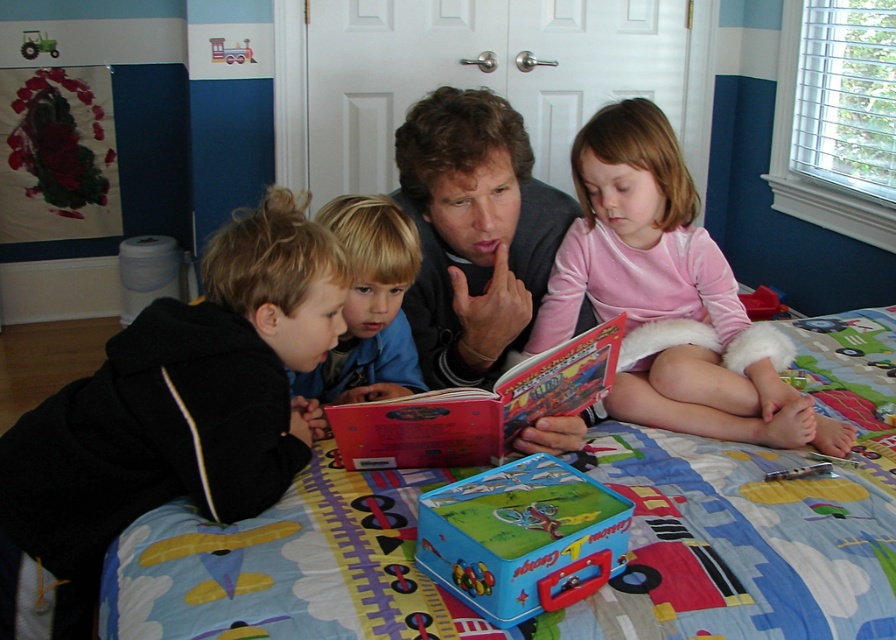
Question: Which of the following is the farthest from the observer?

Choices:
 (A) (799, 420)
 (B) (246, 497)

Answer: (A)

Question: Can you confirm if printed fabric quilt at center is positioned below black fleece hoodie at lower left?

Choices:
 (A) yes
 (B) no

Answer: (A)

Question: Does pink fleece skirt at center have a larger size compared to matte black sweater at center?

Choices:
 (A) no
 (B) yes

Answer: (B)

Question: Which point is farther from the camera taking this photo?

Choices:
 (A) (565, 536)
 (B) (584, 401)

Answer: (B)

Question: Based on their relative distances, which object is farther from the matte black sweater at center?

Choices:
 (A) black fleece hoodie at lower left
 (B) pink fleece skirt at center
 (C) hardcover book at center

Answer: (A)

Question: Is printed fabric quilt at center positioned in front of hardcover book at center?

Choices:
 (A) no
 (B) yes

Answer: (B)